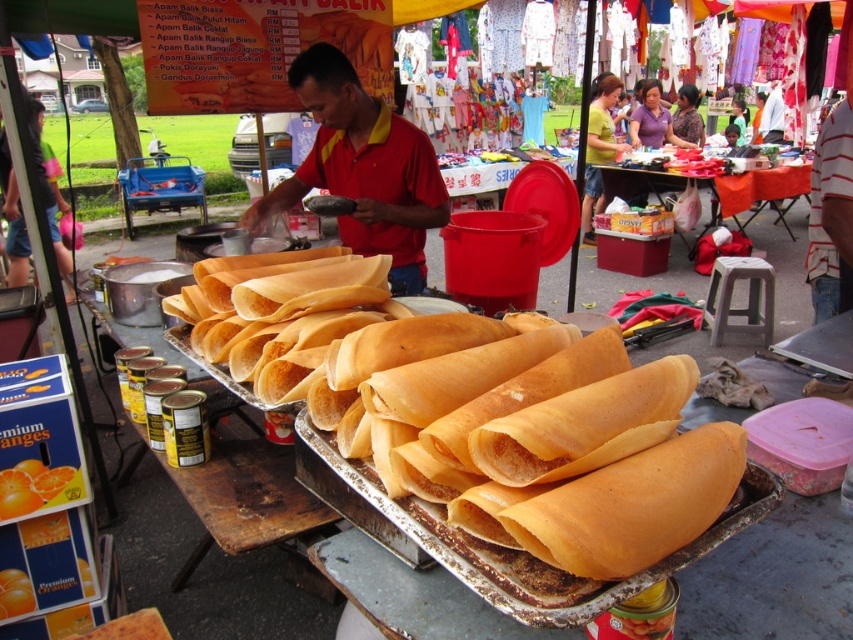
Where is `golden crispy roti at center`? The height and width of the screenshot is (640, 853). golden crispy roti at center is located at coordinates (544, 442).

Between golden crispy roti at center and orange fabric table at center, which one has more height?

orange fabric table at center is taller.

Image resolution: width=853 pixels, height=640 pixels. Find the location of `golden crispy roti at center`. golden crispy roti at center is located at coordinates (544, 442).

Between golden crispy roti at center and red matte shirt at center, which one has less height?

golden crispy roti at center

Does point (561, 340) come closer to viewer compared to point (316, 156)?

Yes, it is.

Between point (543, 404) and point (381, 252), which one is positioned behind?

Point (381, 252)

Locate an element on the screen. The height and width of the screenshot is (640, 853). golden crispy roti at center is located at coordinates (544, 442).

Who is positioned more to the left, red matte shirt at center or orange fabric table at center?

From the viewer's perspective, red matte shirt at center appears more on the left side.

Locate an element on the screen. The width and height of the screenshot is (853, 640). red matte shirt at center is located at coordinates coord(363,168).